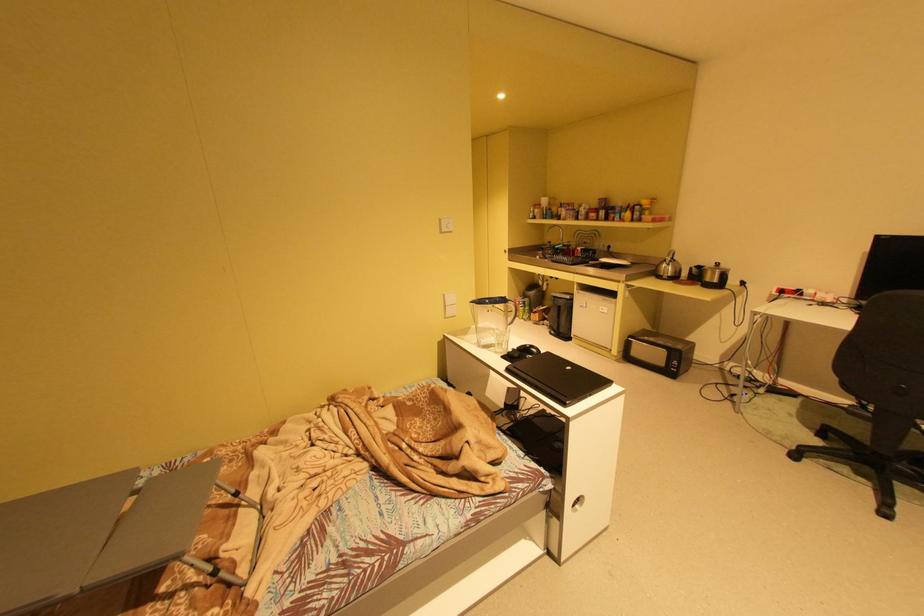
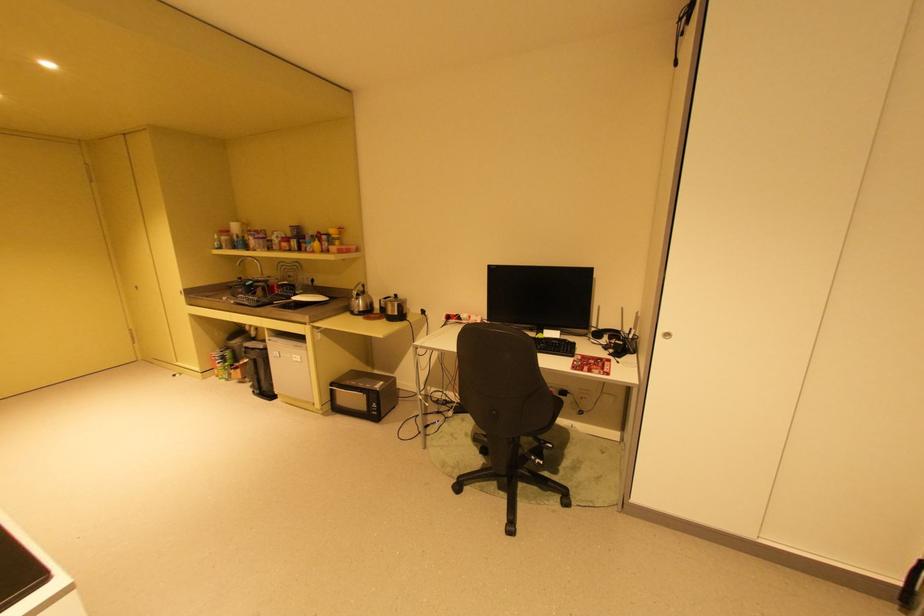
Find the pixel in the second image that matches [566,227] in the first image.

(257, 259)